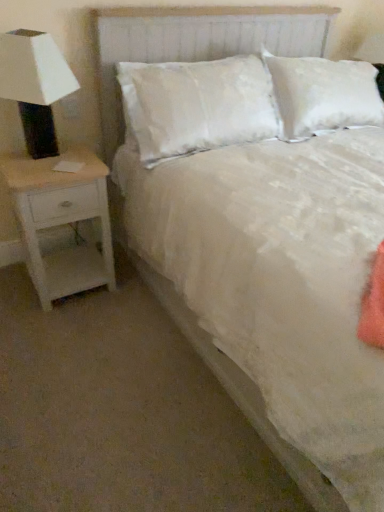
The image size is (384, 512). Find the location of `vacant area that lies to the right of white wood nightstand at left`. vacant area that lies to the right of white wood nightstand at left is located at coordinates 132,298.